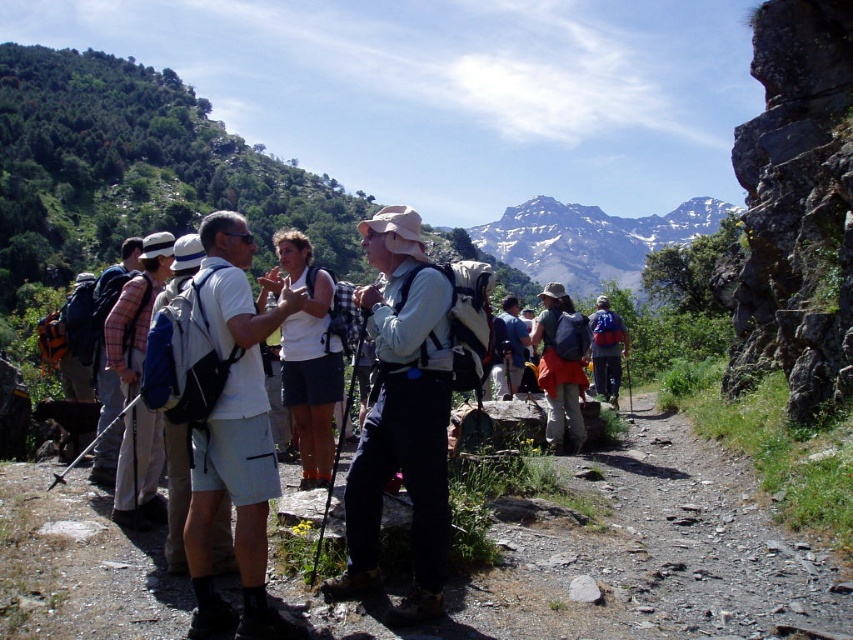
You are a hiker standing at the starting point of the trail. You want to reach the dirt path at center. Which direction should you walk to reach it?

The dirt path at center is located at coordinates point (x=634, y=557), so you should walk towards the center of the image to reach it.